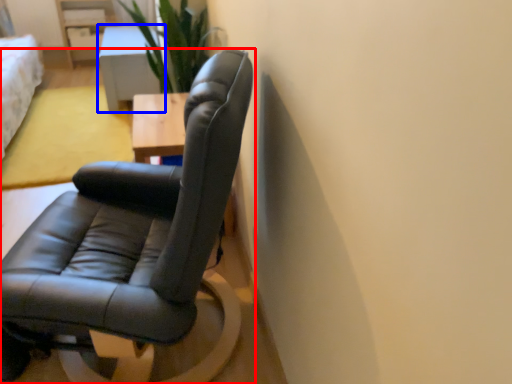
Question: Among these objects, which one is nearest to the camera, chair (highlighted by a red box) or table (highlighted by a blue box)?

Choices:
 (A) chair
 (B) table

Answer: (A)